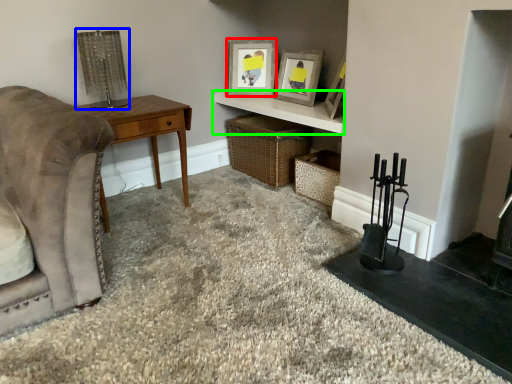
Question: Estimate the real-world distances between objects in this image. Which object is farther from picture frame (highlighted by a red box), lamp (highlighted by a blue box) or cabinetry (highlighted by a green box)?

Choices:
 (A) lamp
 (B) cabinetry

Answer: (A)